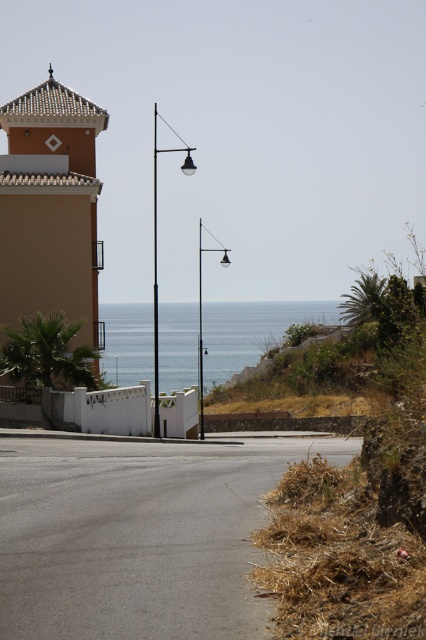
Where is `matte orange building at upper left`? Image resolution: width=426 pixels, height=640 pixels. matte orange building at upper left is located at coordinates (51, 208).

In the scene shown: Is matte orange building at upper left to the left of blue water at center from the viewer's perspective?

Correct, you'll find matte orange building at upper left to the left of blue water at center.

What are the coordinates of `matte orange building at upper left` in the screenshot? It's located at (51, 208).